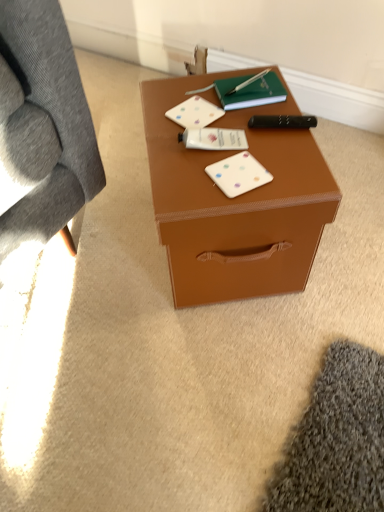
Find the location of a particular element. This screenshot has height=512, width=384. free spot in front of white matte card game at center, which ranks as the 2th card game in back-to-front order is located at coordinates (237, 203).